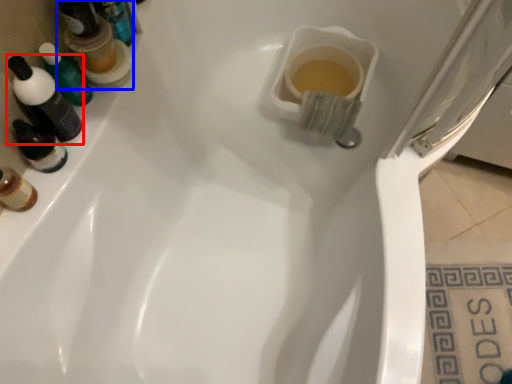
Question: Which of the following is the farthest to the observer, mouthwash (highlighted by a red box) or mouthwash (highlighted by a blue box)?

Choices:
 (A) mouthwash
 (B) mouthwash

Answer: (B)